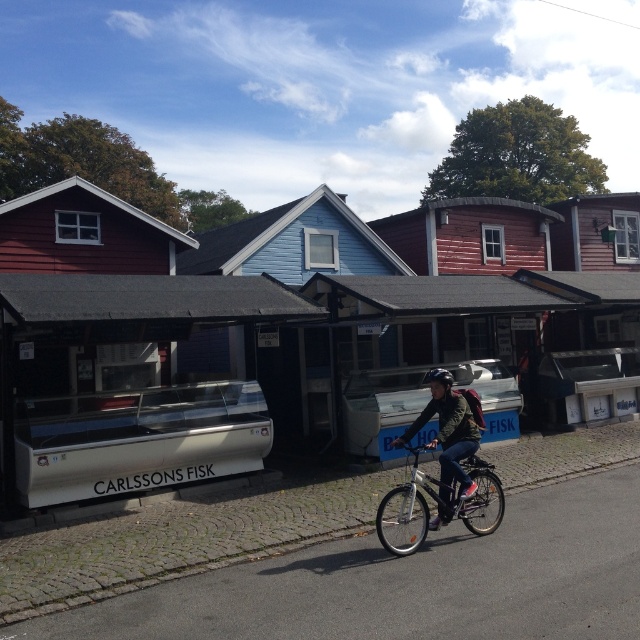
Question: Is metallic glass display case at left wider than silver metallic bicycle at center?

Choices:
 (A) no
 (B) yes

Answer: (B)

Question: Which of the following is the closest to the observer?

Choices:
 (A) metallic glass display case at left
 (B) silver metallic bicycle at center

Answer: (B)

Question: Considering the relative positions of metallic glass display case at left and dark green jacket at center in the image provided, where is metallic glass display case at left located with respect to dark green jacket at center?

Choices:
 (A) right
 (B) left

Answer: (B)

Question: Which of the following is the closest to the observer?

Choices:
 (A) (468, 484)
 (B) (493, 515)

Answer: (A)

Question: Does metallic glass display case at left have a greater width compared to silver metallic bicycle at center?

Choices:
 (A) yes
 (B) no

Answer: (A)

Question: Which is nearer to the metallic glass display case at left?

Choices:
 (A) dark green jacket at center
 (B) silver metallic bicycle at center

Answer: (B)